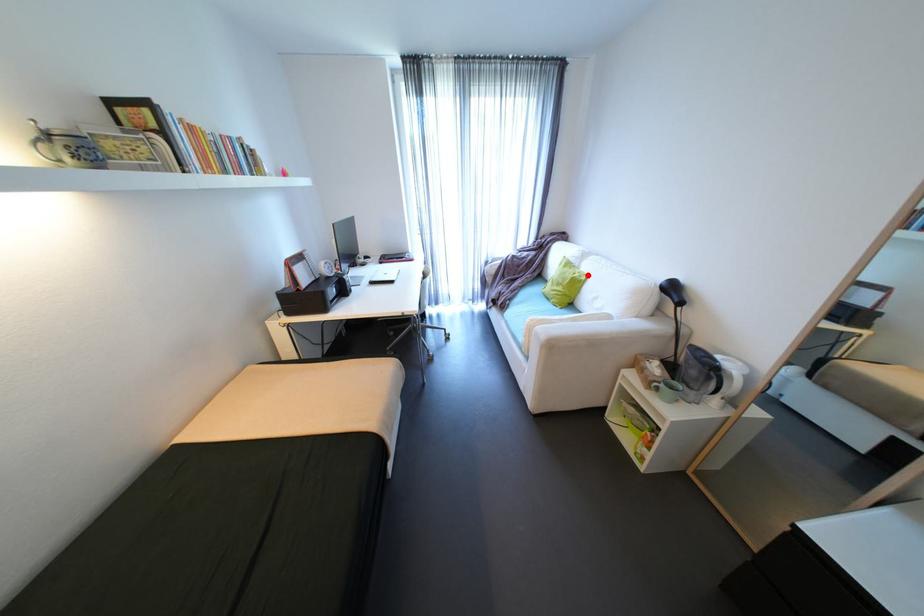
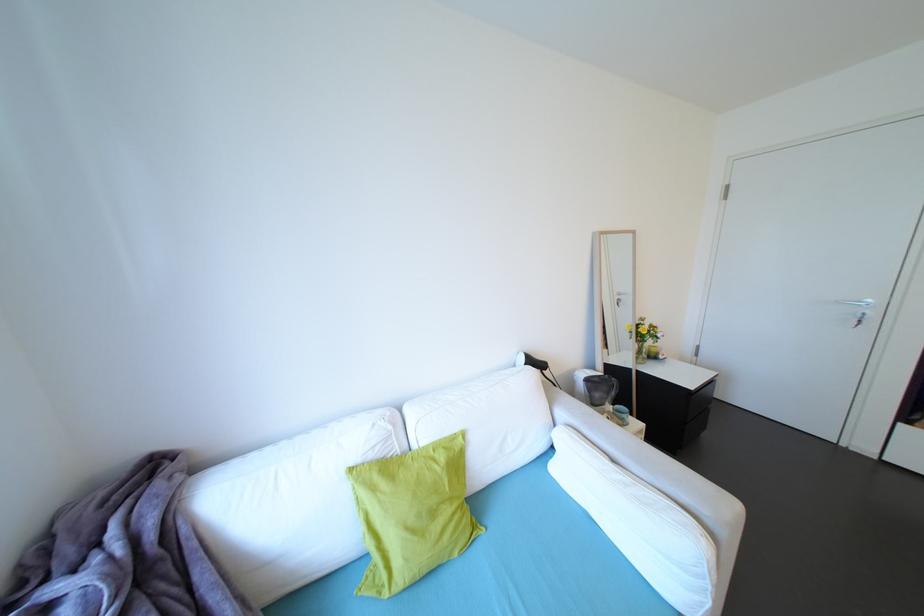
Locate, in the second image, the point that corresponds to the highlighted location in the first image.

(451, 448)